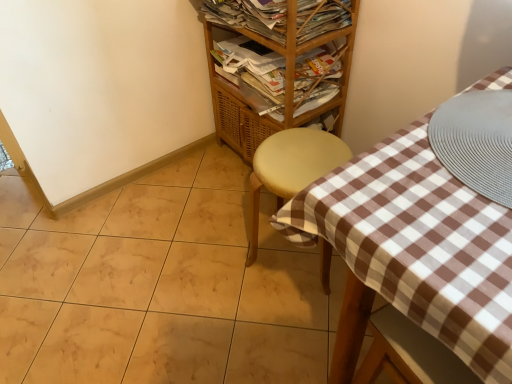
Question: Is wooden magazine rack at upper center, which is the 2th magazine from bottom to top, to the left of matte yellow stool at center from the viewer's perspective?

Choices:
 (A) yes
 (B) no

Answer: (A)

Question: Is matte yellow stool at center completely or partially inside wooden magazine rack at upper center, which is the 1th magazine from top to bottom?

Choices:
 (A) no
 (B) yes

Answer: (A)

Question: Can you confirm if wooden magazine rack at upper center, which is the 2th magazine from bottom to top, is wider than matte yellow stool at center?

Choices:
 (A) yes
 (B) no

Answer: (A)

Question: Is wooden magazine rack at upper center, which is the 1th magazine from top to bottom, outside matte yellow stool at center?

Choices:
 (A) yes
 (B) no

Answer: (A)

Question: From a real-world perspective, is wooden magazine rack at upper center, which is the 1th magazine from top to bottom, located beneath matte yellow stool at center?

Choices:
 (A) yes
 (B) no

Answer: (B)

Question: Do you think wooden/matte shelf at upper center is within wooden magazine at upper center, marked as the 1th magazine in a bottom-to-top arrangement, or outside of it?

Choices:
 (A) outside
 (B) inside

Answer: (A)

Question: Looking at their shapes, would you say wooden/matte shelf at upper center is wider or thinner than wooden magazine at upper center, marked as the 2th magazine in a top-to-bottom arrangement?

Choices:
 (A) thin
 (B) wide

Answer: (B)

Question: In the image, is wooden/matte shelf at upper center on the left side or the right side of wooden magazine at upper center, marked as the 1th magazine in a bottom-to-top arrangement?

Choices:
 (A) left
 (B) right

Answer: (A)

Question: From the image's perspective, is wooden/matte shelf at upper center above or below wooden magazine at upper center, marked as the 1th magazine in a bottom-to-top arrangement?

Choices:
 (A) above
 (B) below

Answer: (A)

Question: Considering the relative positions of matte yellow stool at center and wooden/matte shelf at upper center in the image provided, is matte yellow stool at center to the left or to the right of wooden/matte shelf at upper center?

Choices:
 (A) right
 (B) left

Answer: (A)

Question: Considering their positions, is matte yellow stool at center located in front of or behind wooden/matte shelf at upper center?

Choices:
 (A) front
 (B) behind

Answer: (A)

Question: Is matte yellow stool at center inside the boundaries of wooden/matte shelf at upper center, or outside?

Choices:
 (A) outside
 (B) inside

Answer: (A)

Question: Is matte yellow stool at center taller or shorter than wooden/matte shelf at upper center?

Choices:
 (A) short
 (B) tall

Answer: (A)

Question: Is point (268, 81) positioned closer to the camera than point (265, 13)?

Choices:
 (A) farther
 (B) closer

Answer: (A)

Question: In the image, is wooden magazine at upper center, marked as the 2th magazine in a top-to-bottom arrangement, positioned in front of or behind wooden magazine rack at upper center, which is the 2th magazine from bottom to top?

Choices:
 (A) front
 (B) behind

Answer: (B)